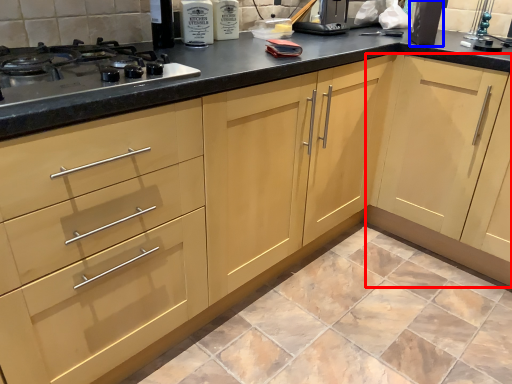
Question: Which object is further to the camera taking this photo, cabinetry (highlighted by a red box) or appliance (highlighted by a blue box)?

Choices:
 (A) cabinetry
 (B) appliance

Answer: (B)